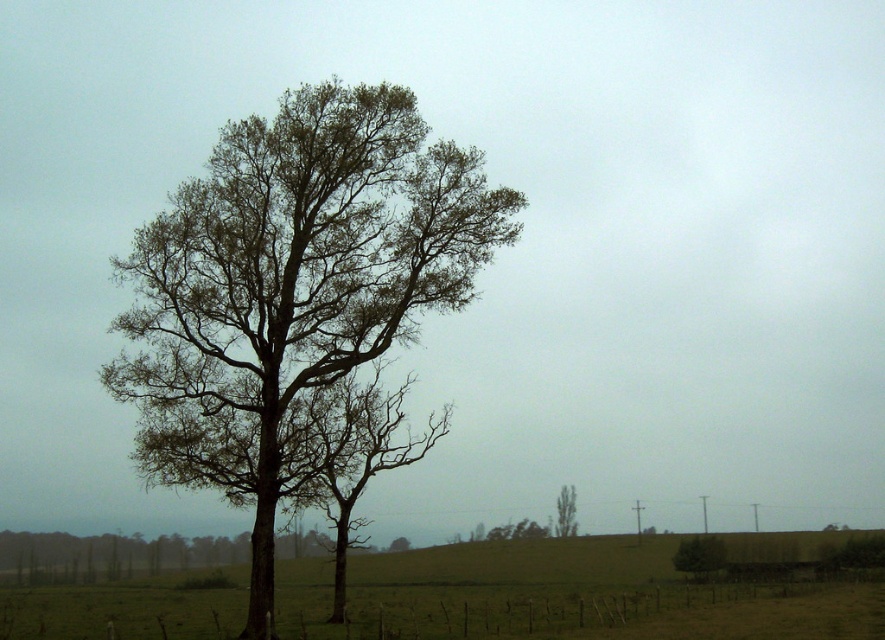
The height and width of the screenshot is (640, 885). Describe the element at coordinates (296, 282) in the screenshot. I see `brown/dry wood tree at center` at that location.

How distant is brown/dry wood tree at center from green grass at center?

brown/dry wood tree at center is 12.61 meters from green grass at center.

At what (x,y) coordinates should I click in order to perform the action: click on brown/dry wood tree at center. Please return your answer as a coordinate pair (x, y). Looking at the image, I should click on (296, 282).

Does brown/dry wood tree at center appear on the left side of green leafy tree at lower right?

Yes, brown/dry wood tree at center is to the left of green leafy tree at lower right.

Is brown/dry wood tree at center positioned at the back of green leafy tree at lower right?

No, it is not.

Identify the location of brown/dry wood tree at center. (296, 282).

At what (x,y) coordinates should I click in order to perform the action: click on brown/dry wood tree at center. Please return your answer as a coordinate pair (x, y). The image size is (885, 640). Looking at the image, I should click on 296,282.

Is point (567, 570) farther from camera compared to point (559, 513)?

No, (567, 570) is closer to viewer.

Is the position of green grass at center more distant than that of green leafy tree at center?

No, green grass at center is in front of green leafy tree at center.

At what (x,y) coordinates should I click in order to perform the action: click on green grass at center. Please return your answer as a coordinate pair (x, y). Looking at the image, I should click on (589, 589).

The height and width of the screenshot is (640, 885). Identify the location of green grass at center. pyautogui.click(x=589, y=589).